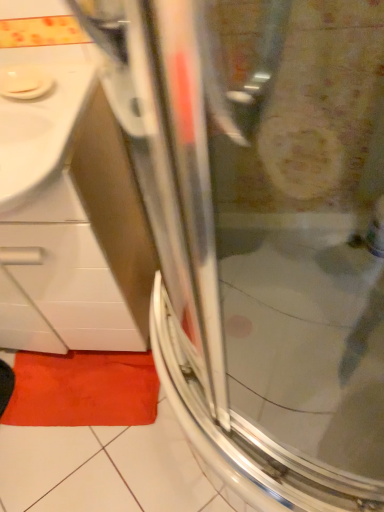
Question: From the image's perspective, would you say orange fabric bath mat at lower left is positioned over white glossy sink at upper left?

Choices:
 (A) yes
 (B) no

Answer: (B)

Question: Would you say white glossy sink at upper left is part of orange fabric bath mat at lower left's contents?

Choices:
 (A) no
 (B) yes

Answer: (A)

Question: Can you confirm if orange fabric bath mat at lower left is taller than white glossy sink at upper left?

Choices:
 (A) no
 (B) yes

Answer: (A)

Question: From a real-world perspective, is orange fabric bath mat at lower left below white glossy sink at upper left?

Choices:
 (A) no
 (B) yes

Answer: (B)

Question: Considering the relative positions of orange fabric bath mat at lower left and white glossy sink at upper left in the image provided, is orange fabric bath mat at lower left in front of white glossy sink at upper left?

Choices:
 (A) no
 (B) yes

Answer: (A)

Question: Is orange fabric bath mat at lower left at the right side of white glossy sink at upper left?

Choices:
 (A) no
 (B) yes

Answer: (B)

Question: Is white glossy sink at upper left positioned far away from orange fabric bath mat at lower left?

Choices:
 (A) no
 (B) yes

Answer: (A)

Question: From the image's perspective, is white glossy sink at upper left located above orange fabric bath mat at lower left?

Choices:
 (A) yes
 (B) no

Answer: (A)

Question: Is white glossy sink at upper left at the left side of orange fabric bath mat at lower left?

Choices:
 (A) yes
 (B) no

Answer: (A)

Question: From a real-world perspective, is white glossy sink at upper left on orange fabric bath mat at lower left?

Choices:
 (A) yes
 (B) no

Answer: (A)

Question: Does white glossy sink at upper left come in front of orange fabric bath mat at lower left?

Choices:
 (A) no
 (B) yes

Answer: (B)

Question: Is white glossy sink at upper left behind orange fabric bath mat at lower left?

Choices:
 (A) yes
 (B) no

Answer: (B)

Question: Looking at their shapes, would you say white glossy sink at upper left is wider or thinner than orange fabric bath mat at lower left?

Choices:
 (A) wide
 (B) thin

Answer: (A)